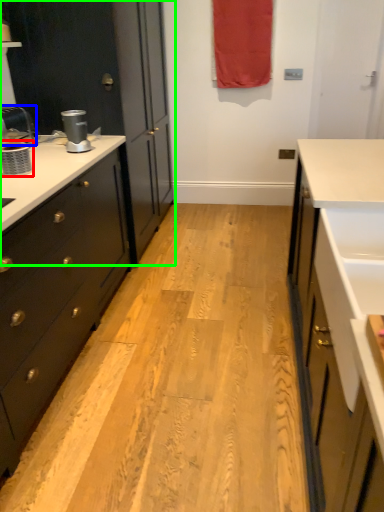
Question: Which is farther away from appliance (highlighted by a red box)? faucet (highlighted by a blue box) or cabinetry (highlighted by a green box)?

Choices:
 (A) faucet
 (B) cabinetry

Answer: (B)